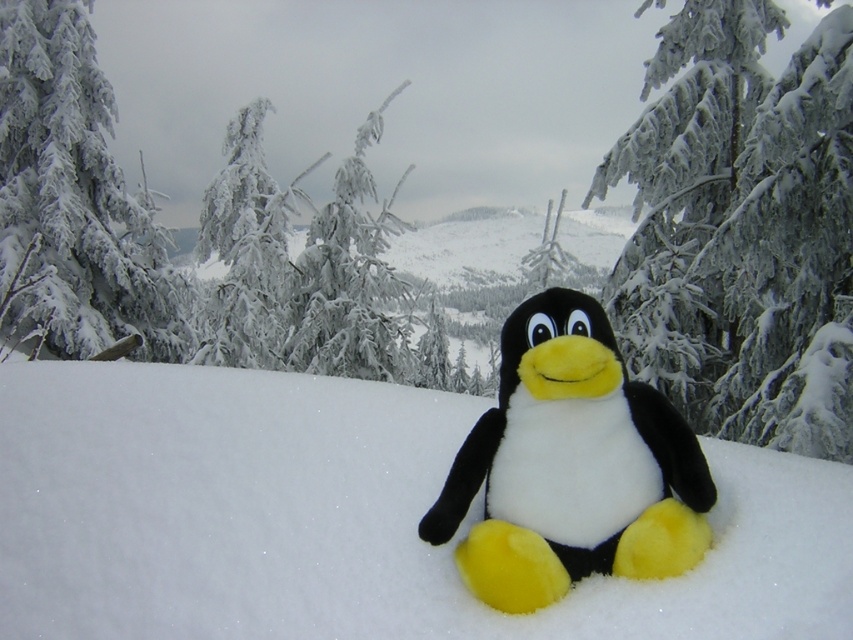
Question: Can you confirm if snow-covered pine tree at center is smaller than frosted snow-covered tree at center?

Choices:
 (A) no
 (B) yes

Answer: (B)

Question: Among these objects, which one is nearest to the camera?

Choices:
 (A) snow-covered pine tree at center
 (B) soft plush penguin at center
 (C) white fluffy snow at center

Answer: (C)

Question: Is snow-covered pine tree at center bigger than white frosty tree at upper center?

Choices:
 (A) no
 (B) yes

Answer: (A)

Question: Does snow-covered pine tree at center come in front of white frosty tree at upper center?

Choices:
 (A) yes
 (B) no

Answer: (A)

Question: Which of the following is the closest to the observer?

Choices:
 (A) (520, 364)
 (B) (689, 208)

Answer: (A)

Question: Estimate the real-world distances between objects in this image. Which object is farther from the white fluffy snow at center?

Choices:
 (A) soft plush penguin at center
 (B) white snow-covered tree at upper left

Answer: (B)